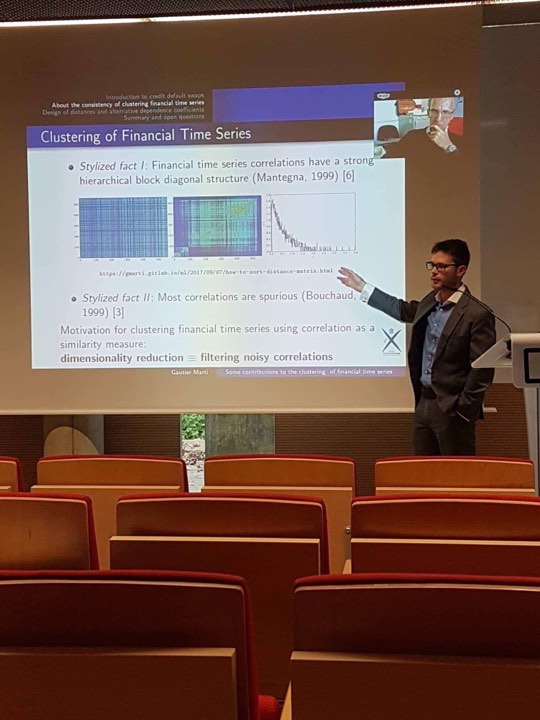
At what (x,y) coordinates should I click in order to perform the action: click on whiteboard. Please return your answer as a coordinate pair (x, y). Image resolution: width=540 pixels, height=720 pixels. Looking at the image, I should click on (494, 109).